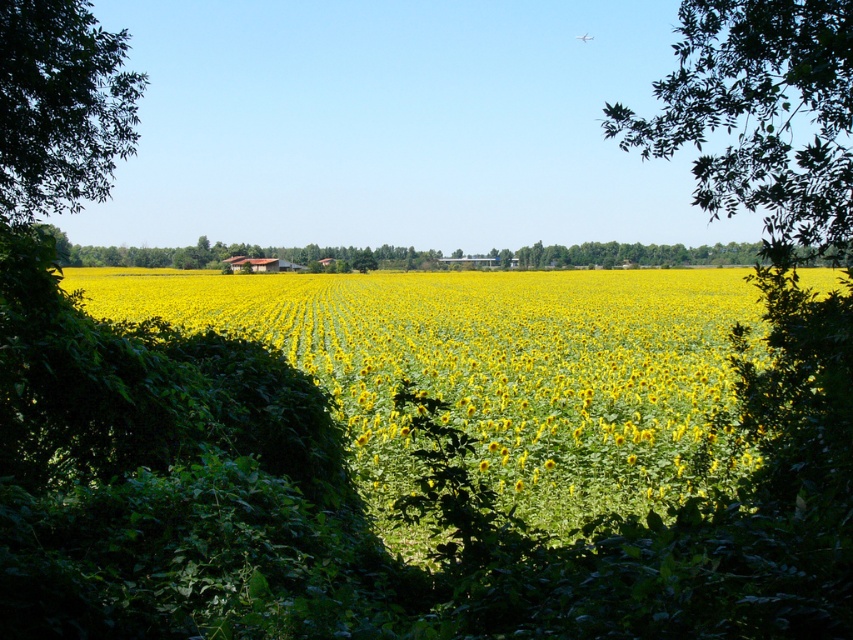
Does point (544, 324) come closer to viewer compared to point (91, 56)?

That is False.

Who is more forward, (523,500) or (86,106)?

Point (523,500)

This screenshot has height=640, width=853. Describe the element at coordinates (491, 365) in the screenshot. I see `yellow matte sunflower at center` at that location.

This screenshot has width=853, height=640. What are the coordinates of `yellow matte sunflower at center` in the screenshot? It's located at (491, 365).

Does point (653, 433) come behind point (701, 38)?

Yes.

Does point (613, 314) come farther from viewer compared to point (730, 26)?

Yes, point (613, 314) is farther from viewer.

Locate an element on the screen. The image size is (853, 640). yellow matte sunflower at center is located at coordinates (491, 365).

Between green leafy tree at upper right and green leafy tree at left, which one has less height?

green leafy tree at left is shorter.

Between green leafy tree at upper right and green leafy tree at left, which one is positioned lower?

Positioned lower is green leafy tree at left.

Find the location of a particular element. The image size is (853, 640). green leafy tree at upper right is located at coordinates (759, 115).